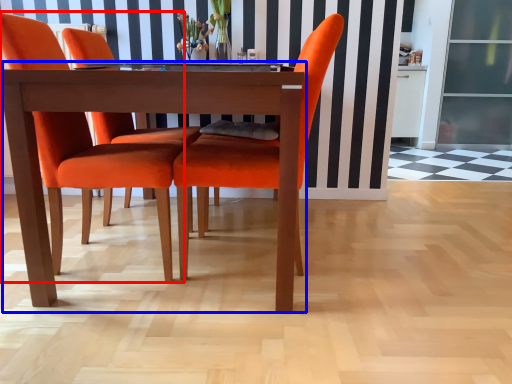
Question: Which object appears closest to the camera in this image, chair (highlighted by a red box) or kitchen & dining room table (highlighted by a blue box)?

Choices:
 (A) chair
 (B) kitchen & dining room table

Answer: (B)